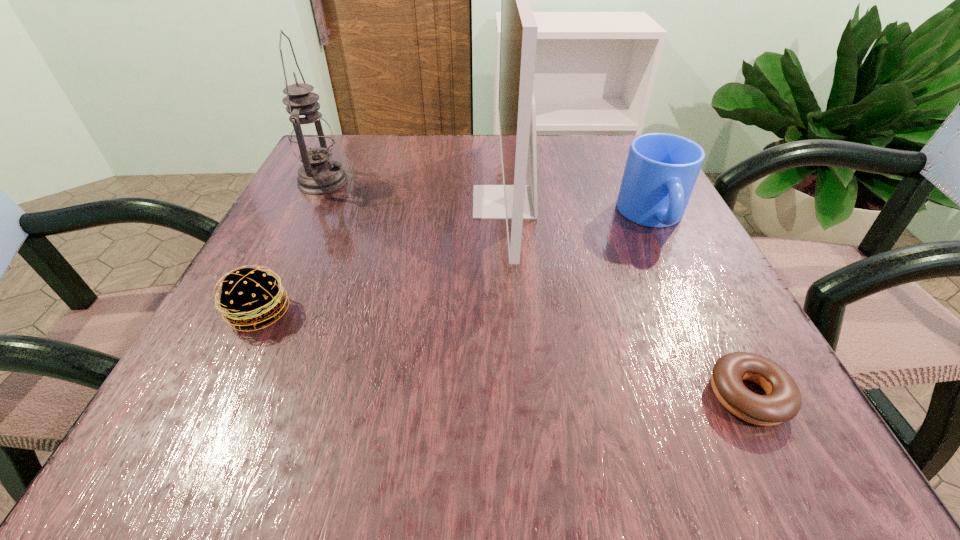
Identify the location of doughnut located in the right edge section of the desktop. (783, 401).

Where is `object that is at the far left corner`? Image resolution: width=960 pixels, height=540 pixels. object that is at the far left corner is located at coordinates tap(311, 139).

The image size is (960, 540). I want to click on object positioned at the near right corner, so click(x=783, y=401).

The height and width of the screenshot is (540, 960). What are the coordinates of `vacant space at the far edge` in the screenshot? It's located at (548, 134).

Where is `vacant space at the near edge of the desktop`? vacant space at the near edge of the desktop is located at coordinates (441, 417).

The height and width of the screenshot is (540, 960). What are the coordinates of `vacant point at the left edge` in the screenshot? It's located at (180, 379).

Locate an element on the screen. vacant space at the right edge of the desktop is located at coordinates (660, 290).

This screenshot has height=540, width=960. Find the location of `free space at the near left corner of the desktop`. free space at the near left corner of the desktop is located at coordinates (285, 409).

Where is `vacant area at the far right corner of the desktop`? vacant area at the far right corner of the desktop is located at coordinates (610, 136).

Locate an element on the screen. Image resolution: width=960 pixels, height=540 pixels. vacant space at the near right corner of the desktop is located at coordinates (691, 407).